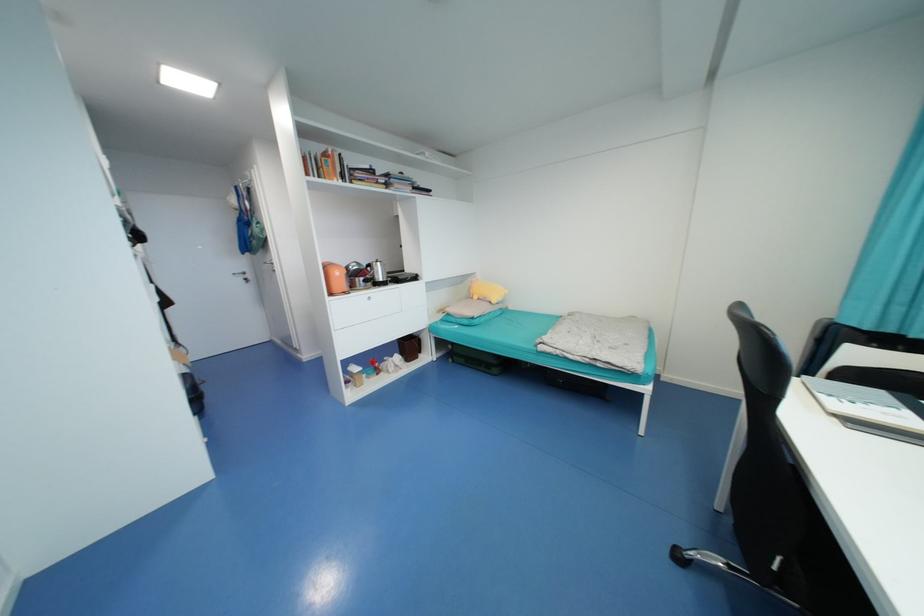
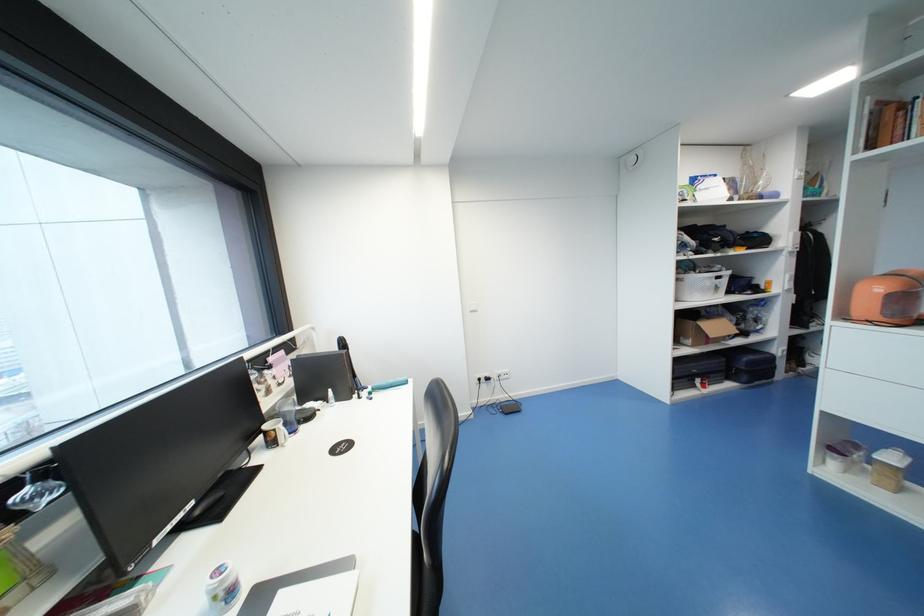
In the second image, find the point that corresponds to pixel 334 294 in the first image.

(849, 318)